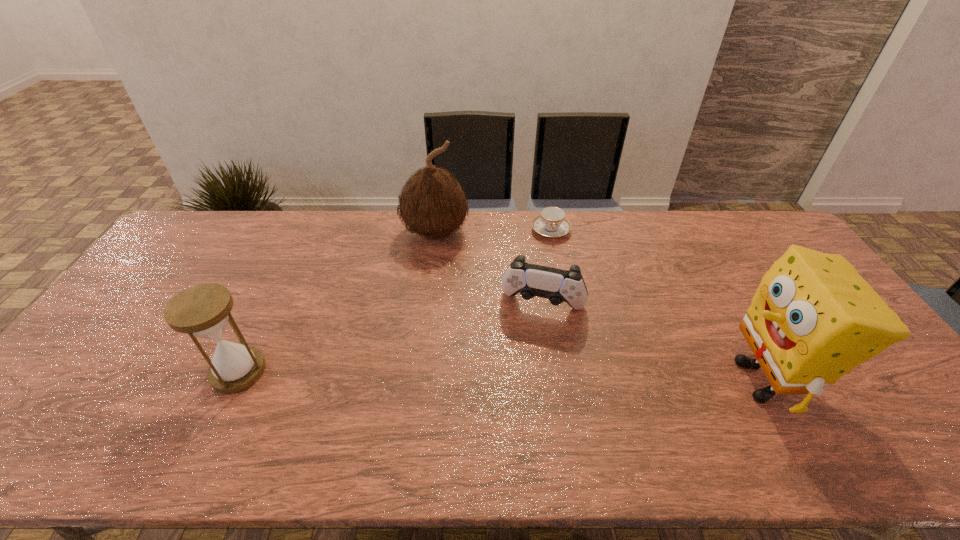
Locate an element on the screen. The height and width of the screenshot is (540, 960). free space on the desktop that is between the leftmost object and the sponge and is positioned on the front-facing side of the control is located at coordinates (526, 376).

Image resolution: width=960 pixels, height=540 pixels. In order to click on vacant space on the desktop that is between the third tallest object and the sponge and is positioned on the surface of the coconut in this screenshot , I will do [x=421, y=375].

Find the location of `vacant spot on the desktop that is between the hourglass and the rightmost object and is positioned on the side with the handle of the teacup`. vacant spot on the desktop that is between the hourglass and the rightmost object and is positioned on the side with the handle of the teacup is located at coordinates (567, 377).